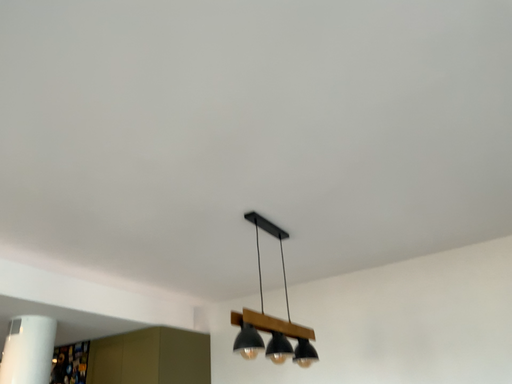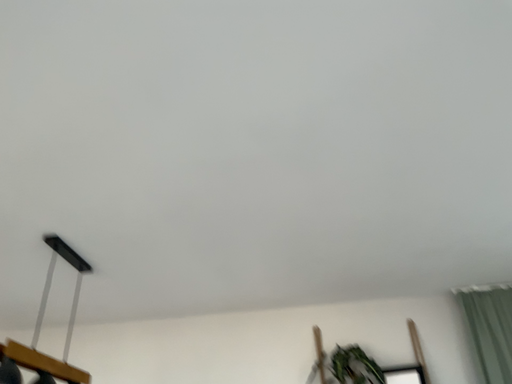
Question: How did the camera likely rotate when shooting the video?

Choices:
 (A) rotated right
 (B) rotated left

Answer: (A)